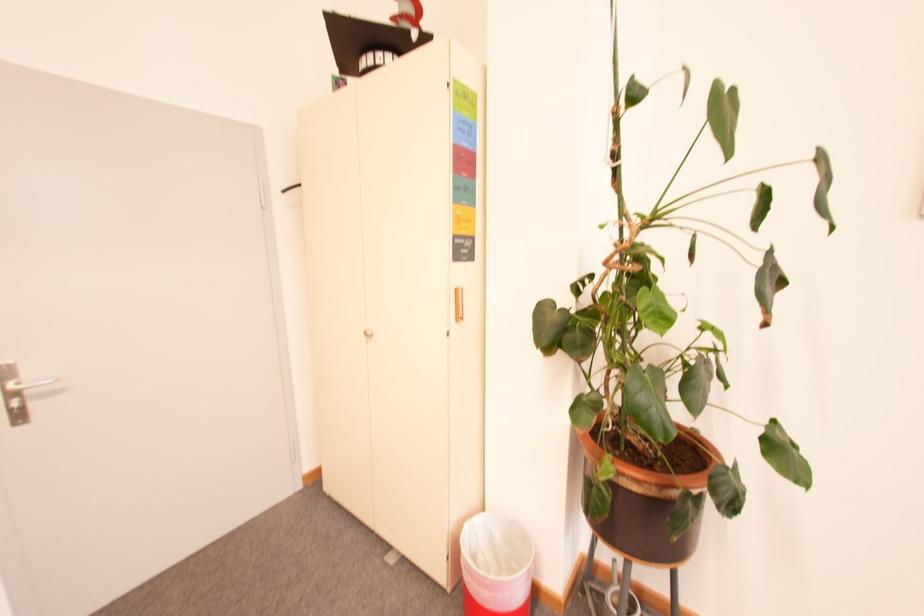
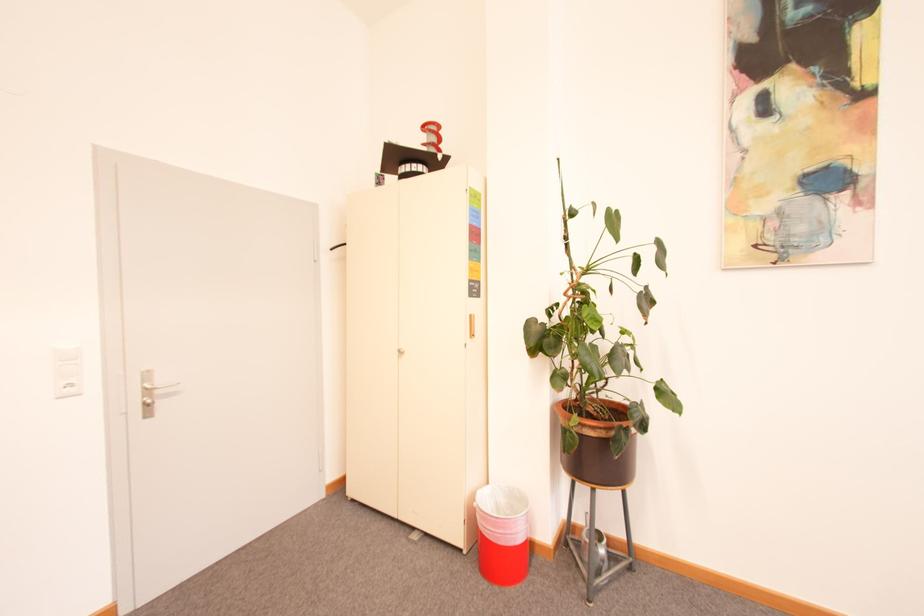
Question: The first image is from the beginning of the video and the second image is from the end. How did the camera likely rotate when shooting the video?

Choices:
 (A) Left
 (B) Right
 (C) Up
 (D) Down

Answer: (C)